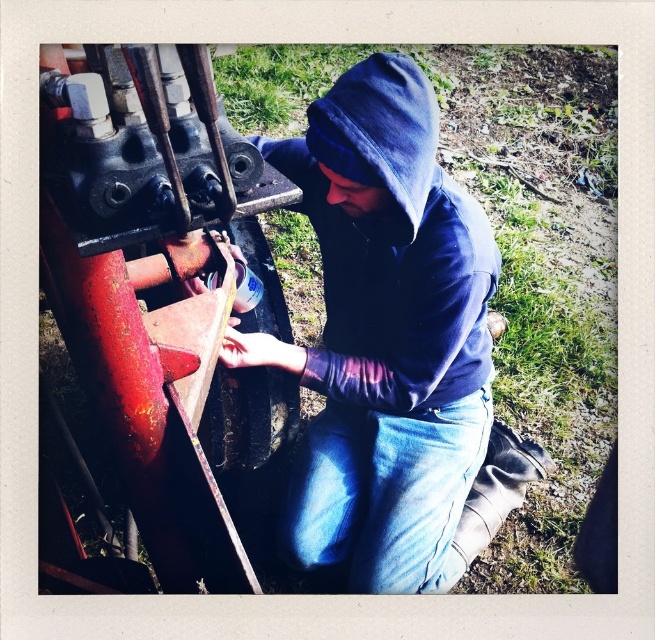
Question: Which object appears farthest from the camera in this image?

Choices:
 (A) denim at center
 (B) blue fleece hoodie at center

Answer: (A)

Question: In this image, where is denim at center located relative to blue fleece hoodie at center?

Choices:
 (A) above
 (B) below

Answer: (B)

Question: Can you confirm if denim at center is positioned below blue fleece hoodie at center?

Choices:
 (A) no
 (B) yes

Answer: (B)

Question: Is denim at center above blue fleece hoodie at center?

Choices:
 (A) no
 (B) yes

Answer: (A)